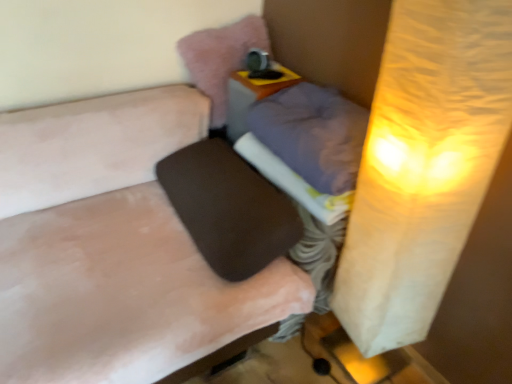
Question: Is black fabric footrest at center facing towards metallic silver table lamp at upper center?

Choices:
 (A) yes
 (B) no

Answer: (B)

Question: From the image's perspective, is black fabric footrest at center below metallic silver table lamp at upper center?

Choices:
 (A) no
 (B) yes

Answer: (B)

Question: Can you confirm if black fabric footrest at center is thinner than metallic silver table lamp at upper center?

Choices:
 (A) yes
 (B) no

Answer: (B)

Question: Can you confirm if black fabric footrest at center is positioned to the right of metallic silver table lamp at upper center?

Choices:
 (A) yes
 (B) no

Answer: (B)

Question: Can you confirm if black fabric footrest at center is shorter than metallic silver table lamp at upper center?

Choices:
 (A) yes
 (B) no

Answer: (B)

Question: Is black fabric footrest at center far away from metallic silver table lamp at upper center?

Choices:
 (A) yes
 (B) no

Answer: (B)

Question: From the image's perspective, is black fabric footrest at center beneath matte plastic table at center?

Choices:
 (A) yes
 (B) no

Answer: (A)

Question: Is black fabric footrest at center far away from matte plastic table at center?

Choices:
 (A) yes
 (B) no

Answer: (B)

Question: Is black fabric footrest at center positioned behind matte plastic table at center?

Choices:
 (A) yes
 (B) no

Answer: (B)

Question: Is black fabric footrest at center wider than matte plastic table at center?

Choices:
 (A) yes
 (B) no

Answer: (A)

Question: Does black fabric footrest at center have a greater height compared to matte plastic table at center?

Choices:
 (A) no
 (B) yes

Answer: (A)

Question: From a real-world perspective, is black fabric footrest at center beneath matte plastic table at center?

Choices:
 (A) no
 (B) yes

Answer: (B)

Question: Considering the relative sizes of white fabric at center and purple fabric pillow at center, the first pillow ordered from the bottom, in the image provided, is white fabric at center wider than purple fabric pillow at center, the first pillow ordered from the bottom,?

Choices:
 (A) yes
 (B) no

Answer: (B)